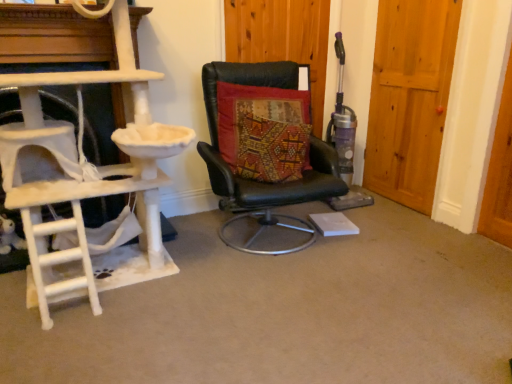
What are the coordinates of `free space in front of white carpeted ladder at left` in the screenshot? It's located at (109, 348).